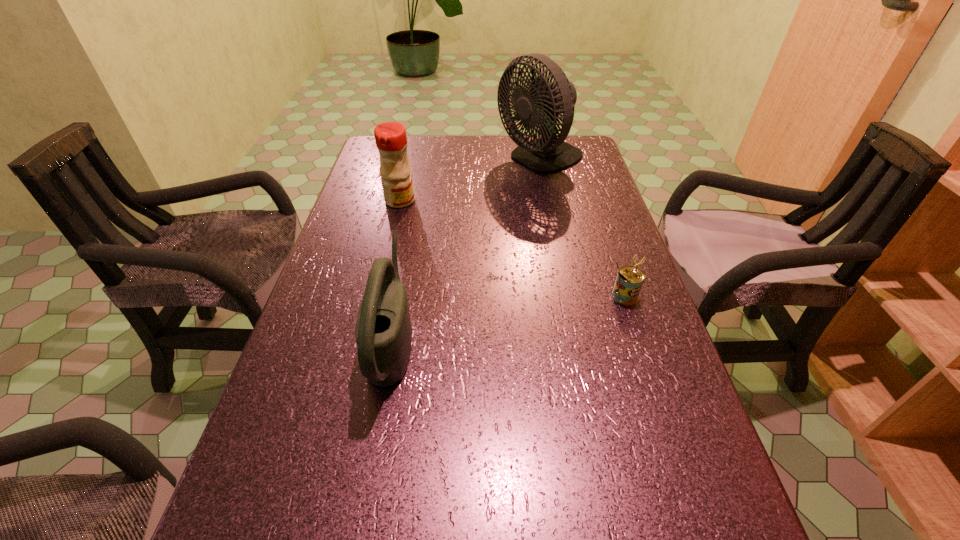
This screenshot has width=960, height=540. Identify the location of the tallest object. (541, 107).

Locate an element on the screen. fan is located at coordinates (541, 107).

This screenshot has width=960, height=540. I want to click on the second farthest object, so click(391, 140).

Find the location of `watering can`. watering can is located at coordinates click(383, 330).

Where is `the shortest object`? The height and width of the screenshot is (540, 960). the shortest object is located at coordinates (629, 280).

Locate an element on the screen. vacant space situated in front of the farthest object to direct airflow is located at coordinates (377, 159).

The image size is (960, 540). In order to click on free space located in front of the farthest object to direct airflow in this screenshot , I will do `click(434, 159)`.

At what (x,y) coordinates should I click in order to perform the action: click on free spot located 0.150m in front of the farthest object to direct airflow. Please return your answer as a coordinate pair (x, y). The width and height of the screenshot is (960, 540). Looking at the image, I should click on [x=451, y=159].

I want to click on free space located 0.240m on the front of the third nearest object, so click(x=384, y=265).

This screenshot has height=540, width=960. Identify the location of free location located on the spout of the watering can. (462, 338).